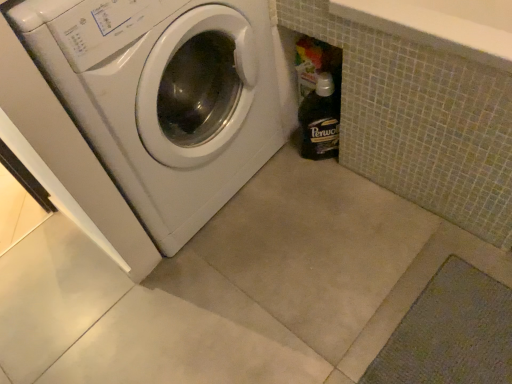
Identify the location of vacant space to the left of black glass bottle at lower right. The height and width of the screenshot is (384, 512). (284, 170).